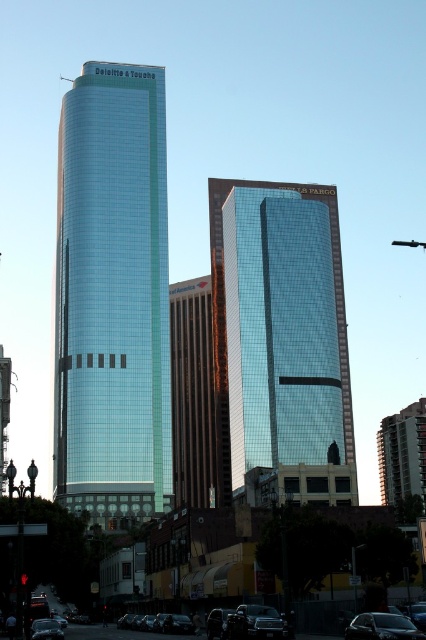
Based on the photo, which is more to the right, glassy blue skyscraper at left or glassy reflective skyscraper at center?

Positioned to the right is glassy reflective skyscraper at center.

Is glassy blue skyscraper at left to the left of glassy reflective skyscraper at center from the viewer's perspective?

Indeed, glassy blue skyscraper at left is positioned on the left side of glassy reflective skyscraper at center.

This screenshot has height=640, width=426. Find the location of `glassy blue skyscraper at left`. glassy blue skyscraper at left is located at coordinates (112, 294).

Locate an element on the screen. This screenshot has height=640, width=426. glassy blue skyscraper at left is located at coordinates (112, 294).

Between glassy reflective skyscraper at center and shiny black car at lower left, which one has more height?

With more height is glassy reflective skyscraper at center.

Does glassy reflective skyscraper at center appear over shiny black car at lower left?

Yes.

Is point (250, 419) positioned in front of point (57, 636)?

No, it is behind (57, 636).

This screenshot has height=640, width=426. Find the location of `glassy reflective skyscraper at center`. glassy reflective skyscraper at center is located at coordinates (279, 333).

Between glassy reflective skyscraper at center and shiny black car at center, which one appears on the left side from the viewer's perspective?

shiny black car at center

Image resolution: width=426 pixels, height=640 pixels. Describe the element at coordinates (279, 333) in the screenshot. I see `glassy reflective skyscraper at center` at that location.

Find the location of `glassy reflective skyscraper at center`. glassy reflective skyscraper at center is located at coordinates (279, 333).